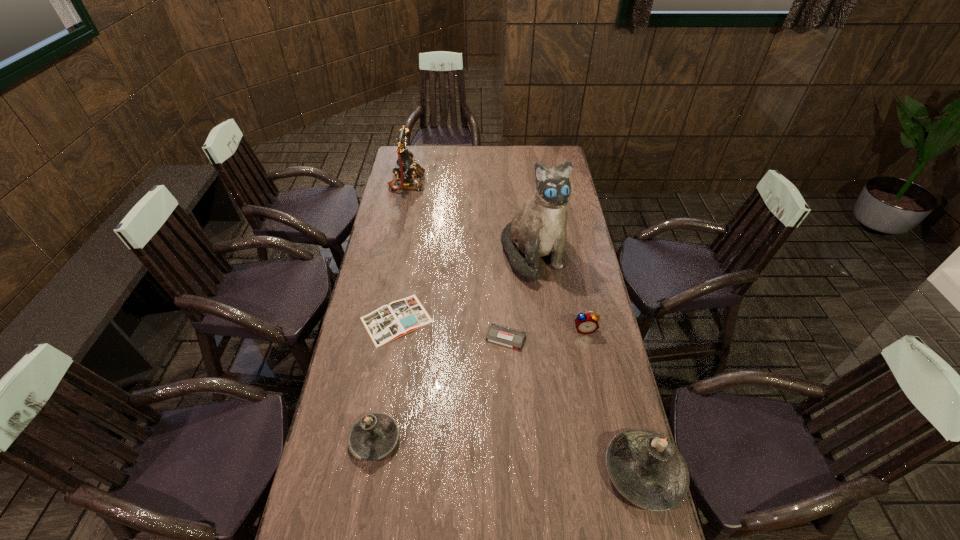
Please point a spot to place another candle for symmetrical spacing. Please provide its 2D coordinates. Your answer should be formatted as a tuple, i.e. [(x, y)], where the tuple contains the x and y coordinates of a point satisfying the conditions above.

[(506, 455)]